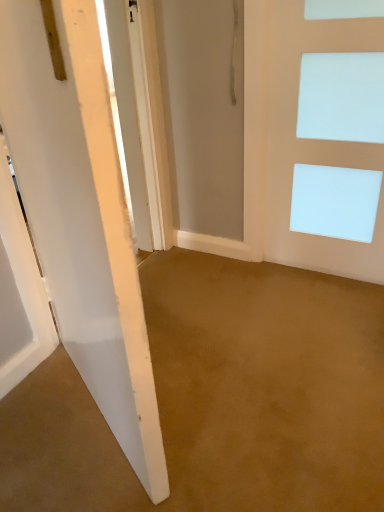
What do you see at coordinates (81, 217) in the screenshot? I see `white matte door at center, the 1th door from the left` at bounding box center [81, 217].

You are a GUI agent. You are given a task and a screenshot of the screen. Output one action in this format:
    pyautogui.click(x=<x>, y=<y>)
    Task: Click on the white matte door at center, the second door when ordered from right to left
    
    Given the screenshot: What is the action you would take?
    pyautogui.click(x=81, y=217)

In order to click on white matte door at right, the second door viewed from the left in this screenshot , I will do `click(313, 142)`.

What do you see at coordinates (313, 142) in the screenshot? Image resolution: width=384 pixels, height=512 pixels. I see `white matte door at right, which is the 1th door from right to left` at bounding box center [313, 142].

The height and width of the screenshot is (512, 384). Find the location of `white matte door at center, the second door when ordered from right to left`. white matte door at center, the second door when ordered from right to left is located at coordinates (81, 217).

Based on the photo, considering the relative positions of white matte door at right, which is the 1th door from right to left, and white matte door at center, the 1th door from the left, in the image provided, is white matte door at right, which is the 1th door from right to left, to the left or to the right of white matte door at center, the 1th door from the left,?

Based on their positions, white matte door at right, which is the 1th door from right to left, is located to the right of white matte door at center, the 1th door from the left.

Is the position of white matte door at right, the second door viewed from the left, less distant than that of white matte door at center, the second door when ordered from right to left?

No, it is behind white matte door at center, the second door when ordered from right to left.

Is point (293, 160) closer to viewer compared to point (27, 36)?

That is False.

From the image's perspective, which one is positioned higher, white matte door at right, which is the 1th door from right to left, or white matte door at center, the second door when ordered from right to left?

white matte door at right, which is the 1th door from right to left, is shown above in the image.

From a real-world perspective, is white matte door at right, the second door viewed from the left, above or below white matte door at center, the 1th door from the left?

In terms of real-world spatial position, white matte door at right, the second door viewed from the left, is below white matte door at center, the 1th door from the left.

Can you confirm if white matte door at right, which is the 1th door from right to left, is wider than white matte door at center, the second door when ordered from right to left?

In fact, white matte door at right, which is the 1th door from right to left, might be narrower than white matte door at center, the second door when ordered from right to left.

Considering the sizes of white matte door at right, the second door viewed from the left, and white matte door at center, the 1th door from the left, in the image, is white matte door at right, the second door viewed from the left, taller or shorter than white matte door at center, the 1th door from the left,?

Clearly, white matte door at right, the second door viewed from the left, is shorter compared to white matte door at center, the 1th door from the left.

Which of these two, white matte door at right, which is the 1th door from right to left, or white matte door at center, the 1th door from the left, is smaller?

Smaller between the two is white matte door at right, which is the 1th door from right to left.

Is white matte door at right, which is the 1th door from right to left, situated inside white matte door at center, the second door when ordered from right to left, or outside?

white matte door at right, which is the 1th door from right to left, is located beyond the bounds of white matte door at center, the second door when ordered from right to left.

Are white matte door at right, the second door viewed from the left, and white matte door at center, the 1th door from the left, located far from each other?

white matte door at right, the second door viewed from the left, is far away from white matte door at center, the 1th door from the left.

In the scene shown: Is white matte door at right, the second door viewed from the left, facing away from white matte door at center, the 1th door from the left?

That's not correct — white matte door at right, the second door viewed from the left, is not looking away from white matte door at center, the 1th door from the left.

How many degrees apart are the facing directions of white matte door at right, the second door viewed from the left, and white matte door at center, the 1th door from the left?

151 degrees.

Looking at this image, how distant is white matte door at right, which is the 1th door from right to left, from white matte door at center, the 1th door from the left?

A distance of 3.83 feet exists between white matte door at right, which is the 1th door from right to left, and white matte door at center, the 1th door from the left.

The height and width of the screenshot is (512, 384). Identify the location of door behind the white matte door at center, the second door when ordered from right to left. (313, 142).

In the image, is white matte door at center, the second door when ordered from right to left, on the left side or the right side of white matte door at right, the second door viewed from the left?

From the image, it's evident that white matte door at center, the second door when ordered from right to left, is to the left of white matte door at right, the second door viewed from the left.

Which object is further away from the camera taking this photo, white matte door at center, the second door when ordered from right to left, or white matte door at right, which is the 1th door from right to left?

white matte door at right, which is the 1th door from right to left, is further from the camera.

Does point (157, 501) appear closer or farther from the camera than point (276, 106)?

Point (157, 501) appears to be closer to the viewer than point (276, 106).

From the image's perspective, does white matte door at center, the second door when ordered from right to left, appear higher than white matte door at right, the second door viewed from the left?

No, from the image's perspective, white matte door at center, the second door when ordered from right to left, is not over white matte door at right, the second door viewed from the left.

From a real-world perspective, which object rests below the other?

white matte door at right, which is the 1th door from right to left, from a real-world perspective.

Considering the relative sizes of white matte door at center, the 1th door from the left, and white matte door at right, the second door viewed from the left, in the image provided, is white matte door at center, the 1th door from the left, wider than white matte door at right, the second door viewed from the left,?

Correct, the width of white matte door at center, the 1th door from the left, exceeds that of white matte door at right, the second door viewed from the left.

Can you confirm if white matte door at center, the second door when ordered from right to left, is taller than white matte door at right, the second door viewed from the left?

Indeed, white matte door at center, the second door when ordered from right to left, has a greater height compared to white matte door at right, the second door viewed from the left.

Considering the sizes of objects white matte door at center, the second door when ordered from right to left, and white matte door at right, the second door viewed from the left, in the image provided, who is smaller, white matte door at center, the second door when ordered from right to left, or white matte door at right, the second door viewed from the left,?

With smaller size is white matte door at right, the second door viewed from the left.

Do you think white matte door at center, the second door when ordered from right to left, is within white matte door at right, the second door viewed from the left, or outside of it?

white matte door at center, the second door when ordered from right to left, is not inside white matte door at right, the second door viewed from the left, it's outside.

Are white matte door at center, the second door when ordered from right to left, and white matte door at right, the second door viewed from the left, located far from each other?

Indeed, white matte door at center, the second door when ordered from right to left, is not near white matte door at right, the second door viewed from the left.

Is white matte door at center, the 1th door from the left, positioned with its back to white matte door at right, which is the 1th door from right to left?

No.

This screenshot has width=384, height=512. In order to click on door that is above the white matte door at center, the second door when ordered from right to left (from the image's perspective) in this screenshot , I will do `click(313, 142)`.

You are a GUI agent. You are given a task and a screenshot of the screen. Output one action in this format:
    pyautogui.click(x=<x>, y=<y>)
    Task: Click on the door that is in front of the white matte door at right, which is the 1th door from right to left
    This screenshot has height=512, width=384.
    Given the screenshot: What is the action you would take?
    pyautogui.click(x=81, y=217)

Locate an element on the screen. This screenshot has width=384, height=512. door behind the white matte door at center, the second door when ordered from right to left is located at coordinates (313, 142).